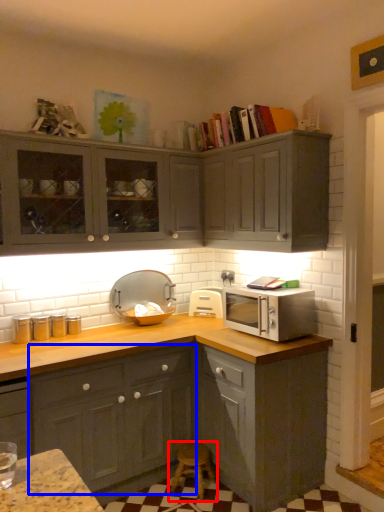
Question: Which of the following is the farthest to the observer, step stool (highlighted by a red box) or cabinetry (highlighted by a blue box)?

Choices:
 (A) step stool
 (B) cabinetry

Answer: (A)